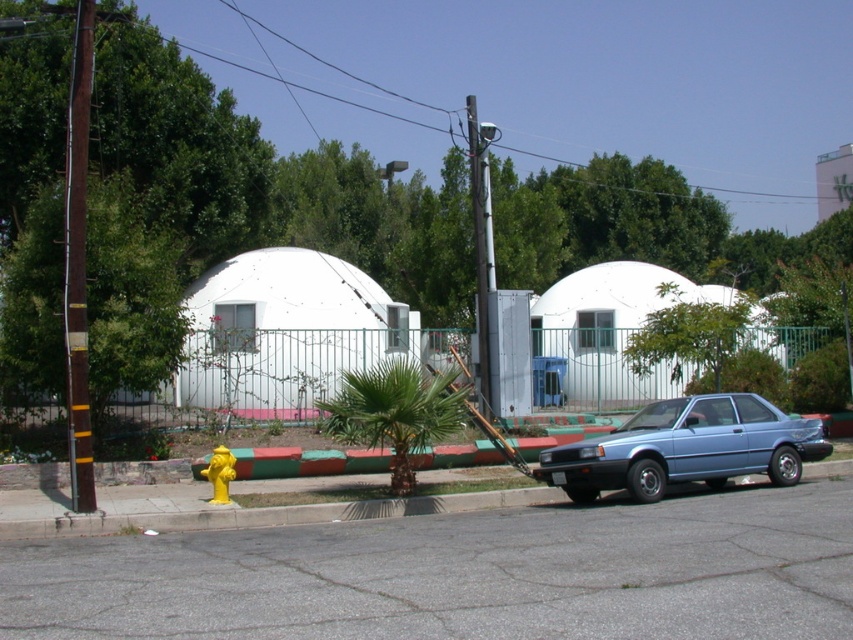
Question: Which of these objects is positioned farthest from the white matte dome at center?

Choices:
 (A) brown wooden pole at left
 (B) blue metallic car at lower right
 (C) white matte pickup truck at center

Answer: (C)

Question: Is white matte pickup truck at center to the right of yellow matte hydrant at lower left from the viewer's perspective?

Choices:
 (A) yes
 (B) no

Answer: (A)

Question: Is white matte pickup truck at center bigger than brown wooden pole at left?

Choices:
 (A) yes
 (B) no

Answer: (A)

Question: Which point is farther to the camera?

Choices:
 (A) brown wooden pole at left
 (B) white matte dome at center

Answer: (B)

Question: Can you confirm if white matte dome at center is smaller than blue metallic car at lower right?

Choices:
 (A) no
 (B) yes

Answer: (B)

Question: Which point is closer to the camera taking this photo?

Choices:
 (A) (225, 497)
 (B) (798, 422)
 (C) (80, 412)

Answer: (C)